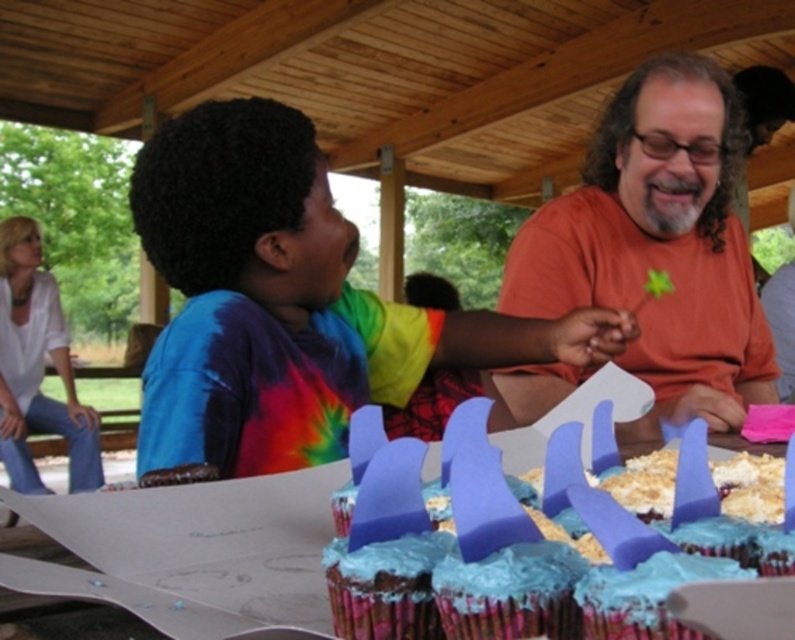
You are at the point marked by the coordinates point (254, 289). Looking around, which object is directly in front of you?

The tie dye shirt at left is directly in front of you at point (254, 289).